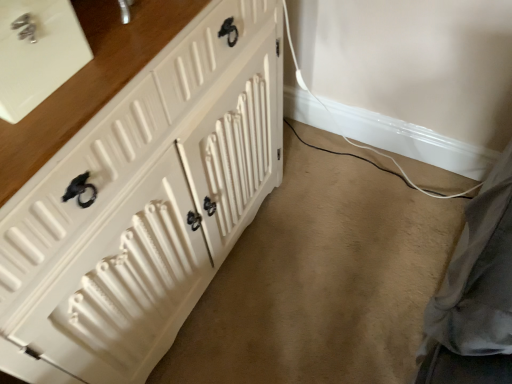
Locate an element on the screen. The height and width of the screenshot is (384, 512). white ceramic sink at upper left is located at coordinates (37, 53).

Describe the element at coordinates (37, 53) in the screenshot. I see `white ceramic sink at upper left` at that location.

Image resolution: width=512 pixels, height=384 pixels. Identify the location of white ceramic sink at upper left. (37, 53).